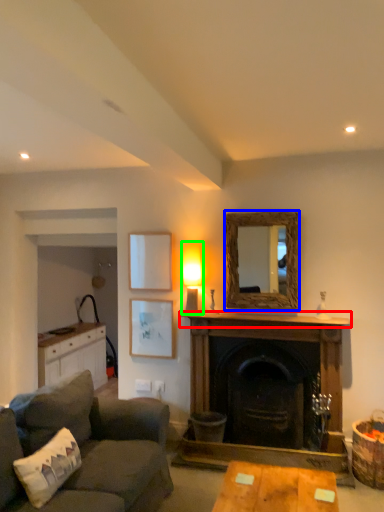
Question: Estimate the real-world distances between objects in this image. Which object is closer to mantle (highlighted by a red box), mirror (highlighted by a blue box) or lamp (highlighted by a green box)?

Choices:
 (A) mirror
 (B) lamp

Answer: (A)